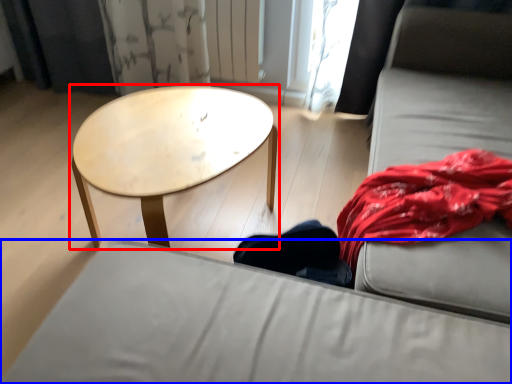
Question: Among these objects, which one is nearest to the camera, coffee table (highlighted by a red box) or studio couch (highlighted by a blue box)?

Choices:
 (A) coffee table
 (B) studio couch

Answer: (B)